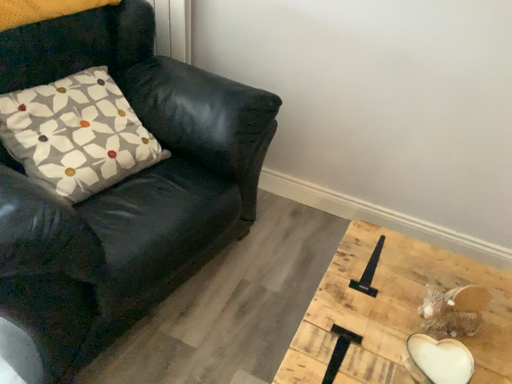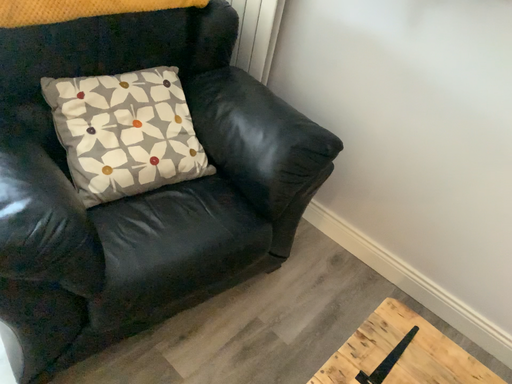
Question: How did the camera likely rotate when shooting the video?

Choices:
 (A) rotated left
 (B) rotated right

Answer: (A)